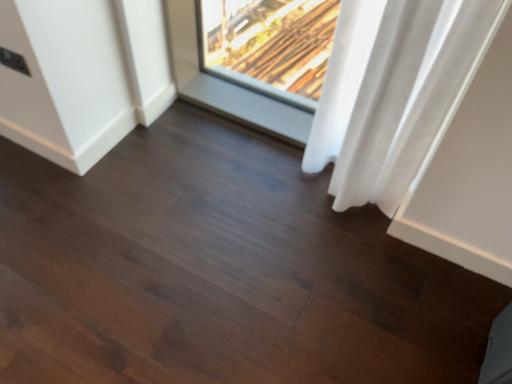
Locate an element on the screen. Image resolution: width=512 pixels, height=384 pixels. white sheer curtain at right is located at coordinates (394, 92).

The height and width of the screenshot is (384, 512). What do you see at coordinates (394, 92) in the screenshot?
I see `white sheer curtain at right` at bounding box center [394, 92].

Find the location of a particular element. white sheer curtain at right is located at coordinates (394, 92).